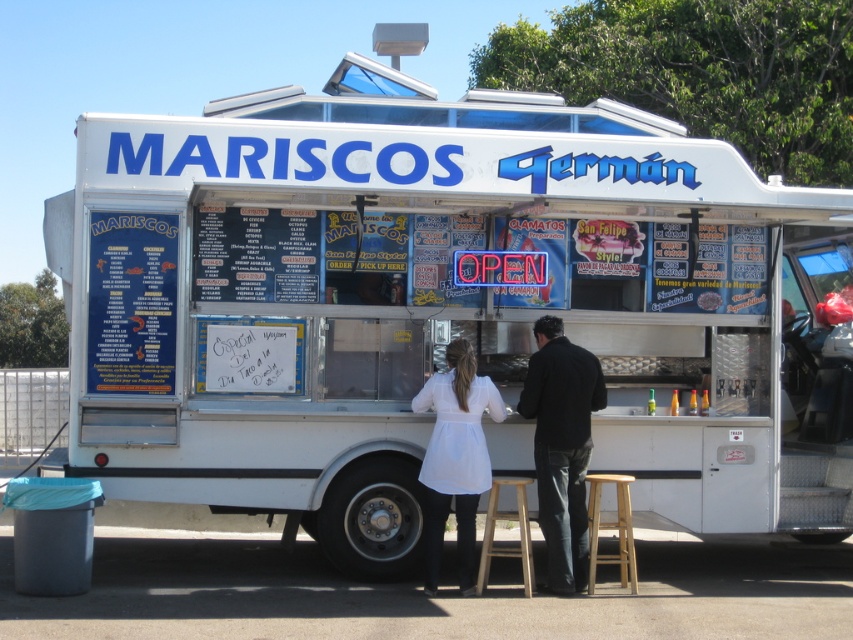
Question: Does white fabric coat at center have a lesser width compared to light brown wooden stool at lower center?

Choices:
 (A) yes
 (B) no

Answer: (B)

Question: Estimate the real-world distances between objects in this image. Which object is closer to the white fabric apron at center?

Choices:
 (A) black matte jacket at center
 (B) wooden stool at center

Answer: (B)

Question: Does white fabric coat at center appear on the left side of white fabric apron at center?

Choices:
 (A) yes
 (B) no

Answer: (B)

Question: Is black matte jacket at center to the right of wooden stool at center from the viewer's perspective?

Choices:
 (A) yes
 (B) no

Answer: (A)

Question: Among these points, which one is nearest to the camera?

Choices:
 (A) (566, 342)
 (B) (605, 525)
 (C) (440, 413)

Answer: (C)

Question: Which object is positioned farthest from the white fabric apron at center?

Choices:
 (A) wooden stool at center
 (B) light brown wooden stool at lower center

Answer: (B)